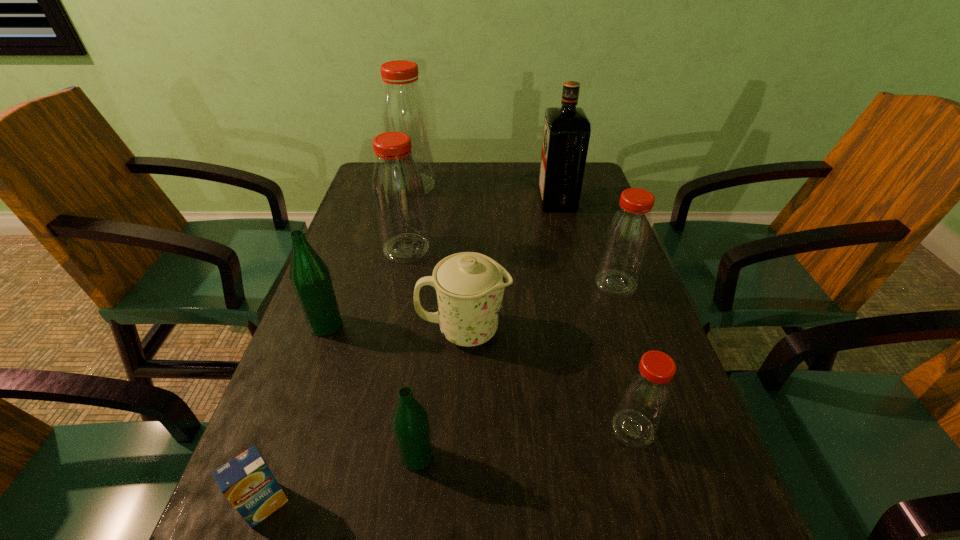
Locate an element on the screen. The image size is (960, 540). object that is at the far left corner is located at coordinates (403, 108).

Where is `object that is at the far right corner`? This screenshot has height=540, width=960. object that is at the far right corner is located at coordinates (566, 133).

In order to click on vacant space at the left edge in this screenshot , I will do `click(288, 534)`.

Find the location of a particular element. vacant space at the right edge of the desktop is located at coordinates (688, 457).

Identify the location of free space between the second biggest red bottle and the nearest red bottle. (519, 339).

This screenshot has height=540, width=960. In order to click on vacant space that is in between the smallest red bottle and the blue orange_juice in this screenshot , I will do `click(449, 467)`.

Locate an element on the screen. vacant space that is in between the chinaware and the second farthest bottle is located at coordinates (435, 289).

This screenshot has height=540, width=960. Find the location of `free spot between the chinaware and the third nearest red bottle`. free spot between the chinaware and the third nearest red bottle is located at coordinates (435, 289).

Where is `vacant region between the smaller green bottle and the bigger green bottle`? vacant region between the smaller green bottle and the bigger green bottle is located at coordinates (372, 391).

Locate an element on the screen. Image resolution: width=960 pixels, height=540 pixels. unoccupied position between the liquor and the chinaware is located at coordinates (511, 266).